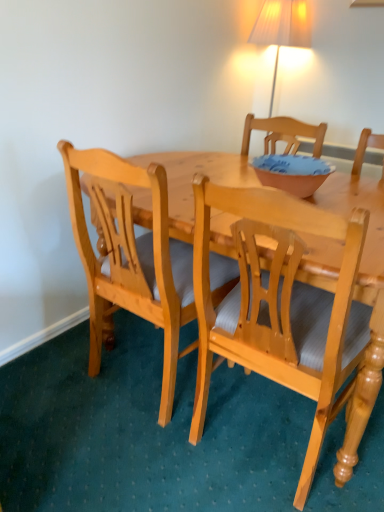
Question: Is point (302, 195) positioned closer to the camera than point (130, 253)?

Choices:
 (A) farther
 (B) closer

Answer: (A)

Question: From a real-world perspective, is matte pink bowl at center above or below light wood chair at center, the first chair positioned from the left?

Choices:
 (A) below
 (B) above

Answer: (B)

Question: Considering the real-world distances, which object is farthest from the light wood chair at center, the first chair positioned from the left?

Choices:
 (A) light wood chair at center, the second chair positioned from the left
 (B) matte pink bowl at center

Answer: (B)

Question: Based on their relative distances, which object is farther from the light wood chair at center, the second chair positioned from the left?

Choices:
 (A) light wood chair at center, the second chair viewed from the right
 (B) matte pink bowl at center

Answer: (B)